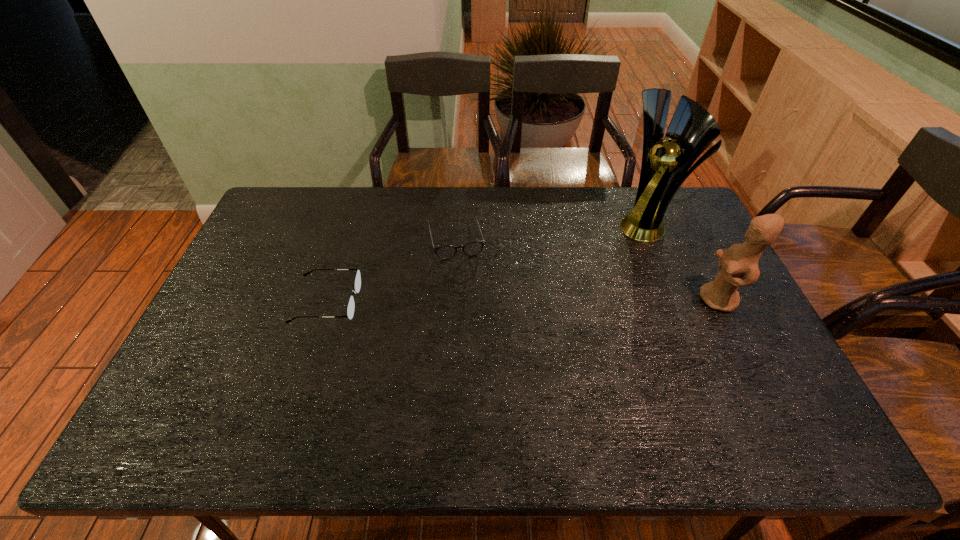
Find the location of a particular element. Image resolution: width=960 pixels, height=540 pixels. free space on the desktop that is between the nearer spectacles and the third shortest object and is positioned at the front of the award, where the globe is visible is located at coordinates (531, 301).

The image size is (960, 540). Identify the location of free space on the desktop that is between the nearer spectacles and the second tallest object and is positioned through the lenses of the right spectacles. (471, 301).